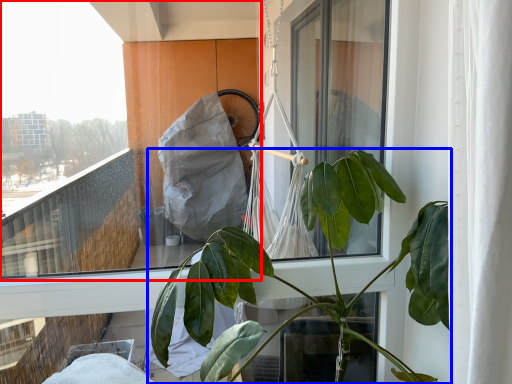
Question: Which object is closer to the camera taking this photo, window (highlighted by a red box) or houseplant (highlighted by a blue box)?

Choices:
 (A) window
 (B) houseplant

Answer: (B)